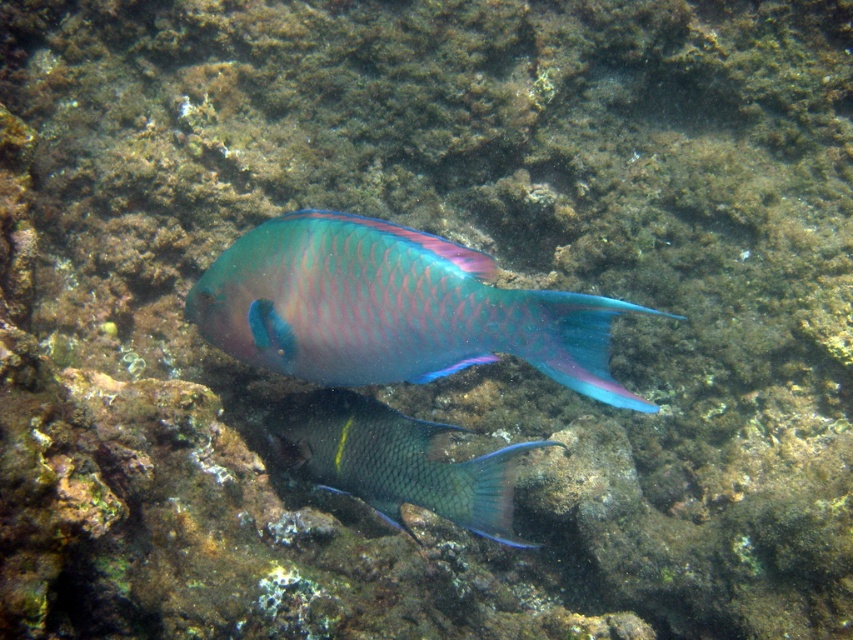
Who is positioned more to the right, metallic iridescent fish at center or shiny blue-green fish at center?

From the viewer's perspective, metallic iridescent fish at center appears more on the right side.

Looking at this image, does metallic iridescent fish at center appear on the left side of shiny blue-green fish at center?

Incorrect, metallic iridescent fish at center is not on the left side of shiny blue-green fish at center.

Does point (310, 308) come behind point (488, 502)?

No.

What are the coordinates of `metallic iridescent fish at center` in the screenshot? It's located at (392, 308).